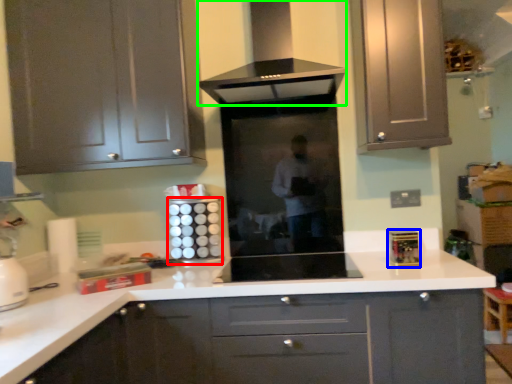
Question: Which object is positioned farthest from appliance (highlighted by a red box)? Select from appliance (highlighted by a blue box) and home appliance (highlighted by a green box).

Choices:
 (A) appliance
 (B) home appliance

Answer: (A)